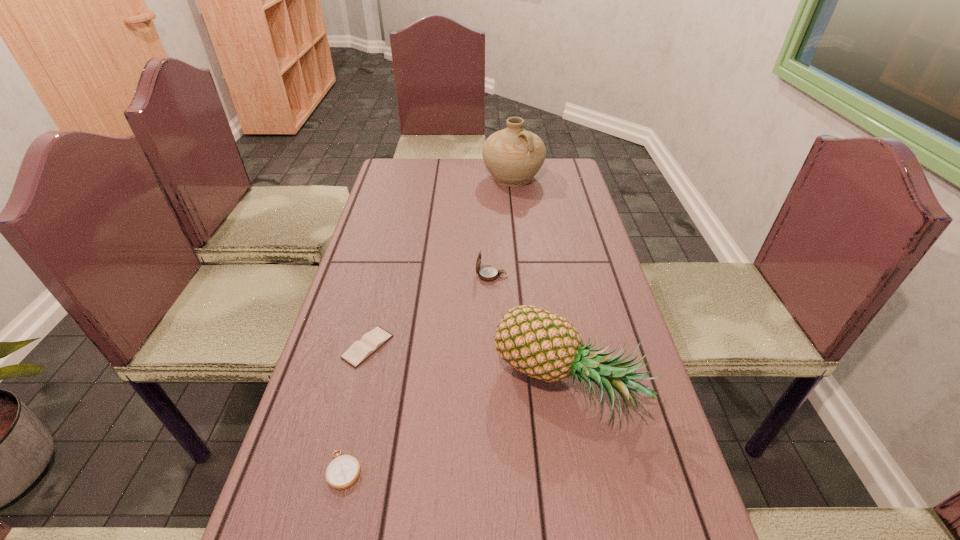
Where is `free space that satisfies the following two spatial constraints: 1. on the face of the third shortest object; 2. on the front side of the diary`? The image size is (960, 540). free space that satisfies the following two spatial constraints: 1. on the face of the third shortest object; 2. on the front side of the diary is located at coordinates (494, 347).

Where is `free space that satisfies the following two spatial constraints: 1. on the front side of the diary; 2. on the left side of the shorter compass`? free space that satisfies the following two spatial constraints: 1. on the front side of the diary; 2. on the left side of the shorter compass is located at coordinates (337, 470).